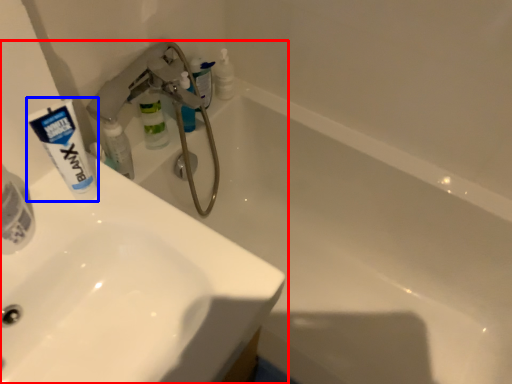
Question: Which point is further to the camera, sink (highlighted by a red box) or toothpaste (highlighted by a blue box)?

Choices:
 (A) sink
 (B) toothpaste

Answer: (B)